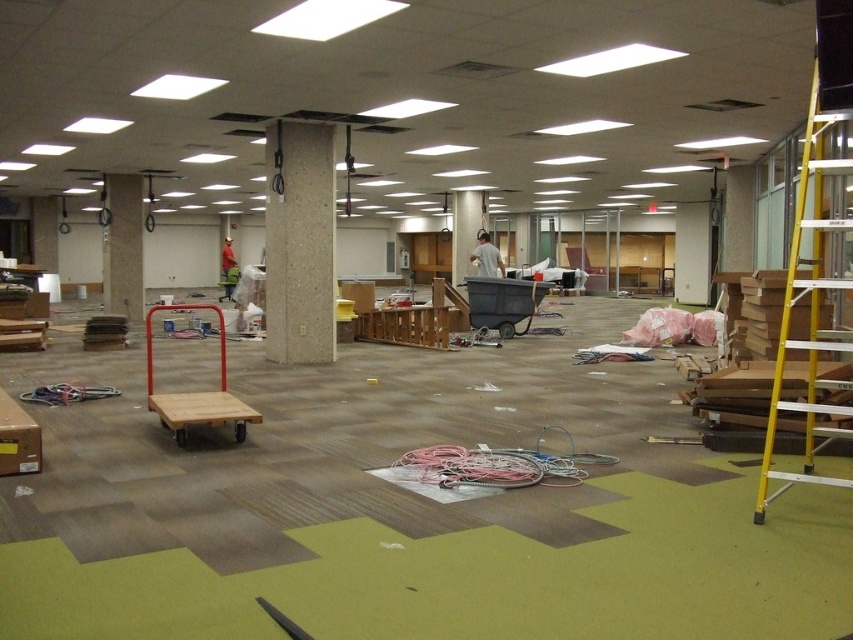
Question: Does yellow metallic ladder at right have a greater width compared to wooden cart at center?

Choices:
 (A) yes
 (B) no

Answer: (B)

Question: Observing the image, what is the correct spatial positioning of beige speckled concrete pillar at center in reference to white fabric shirt at center?

Choices:
 (A) above
 (B) below

Answer: (B)

Question: Which of the following is the closest to the observer?

Choices:
 (A) beige speckled concrete pillar at center
 (B) white fabric shirt at center
 (C) yellow metallic ladder at right
 (D) white glossy pillar at center

Answer: (C)

Question: Which point is farther to the camera?

Choices:
 (A) (148, 355)
 (B) (508, 310)
 (C) (817, 67)

Answer: (B)

Question: Can you confirm if yellow metallic ladder at right is smaller than wooden cart at center?

Choices:
 (A) no
 (B) yes

Answer: (B)

Question: Which point is farther from the camera taking this photo?

Choices:
 (A) (502, 272)
 (B) (213, 416)

Answer: (A)